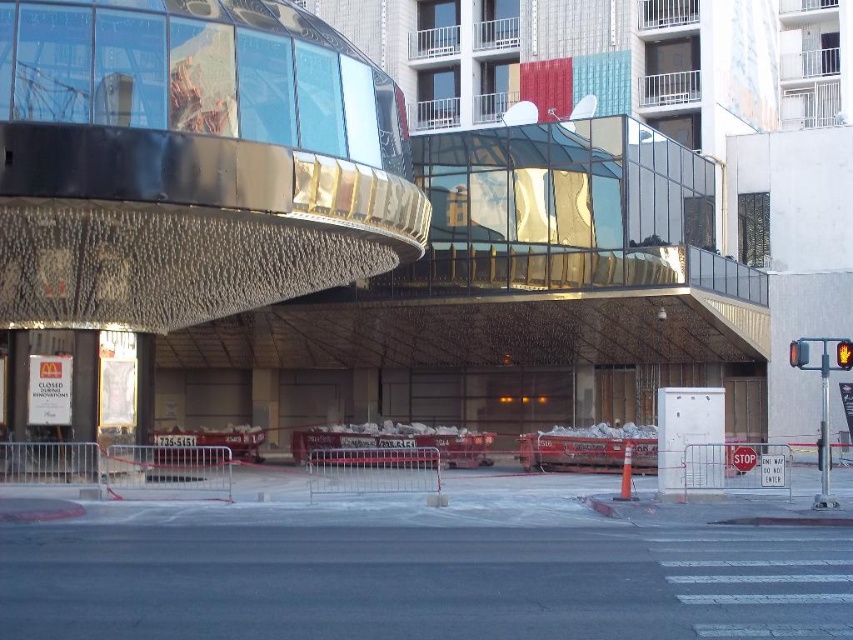
Question: Is red glass traffic light at right below yellow matte pedestrian signal at upper right?

Choices:
 (A) yes
 (B) no

Answer: (A)

Question: Which object appears farthest from the camera in this image?

Choices:
 (A) red glass traffic light at right
 (B) yellow matte pedestrian signal at upper right

Answer: (A)

Question: Does red glass traffic light at right appear over yellow matte pedestrian signal at upper right?

Choices:
 (A) no
 (B) yes

Answer: (A)

Question: Which object appears closest to the camera in this image?

Choices:
 (A) red glass traffic light at right
 (B) yellow matte pedestrian signal at upper right

Answer: (B)

Question: Does red glass traffic light at right have a smaller size compared to yellow matte pedestrian signal at upper right?

Choices:
 (A) no
 (B) yes

Answer: (A)